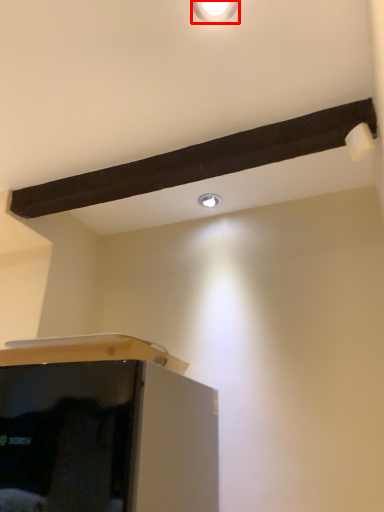
Question: In this image, where is light fixture (annotated by the red box) located relative to droplight?

Choices:
 (A) right
 (B) left

Answer: (B)